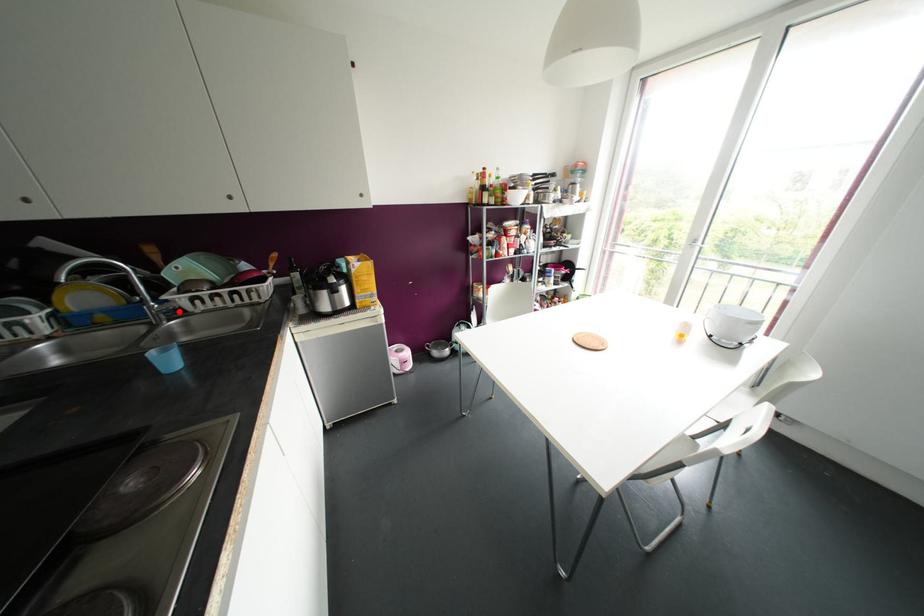
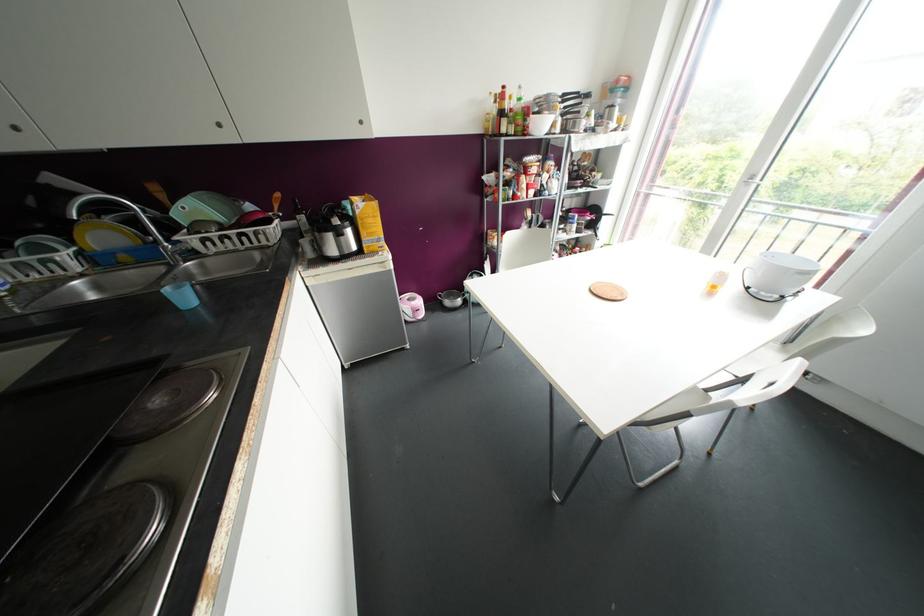
In the second image, find the point that corresponds to the highlighted location in the first image.

(192, 253)